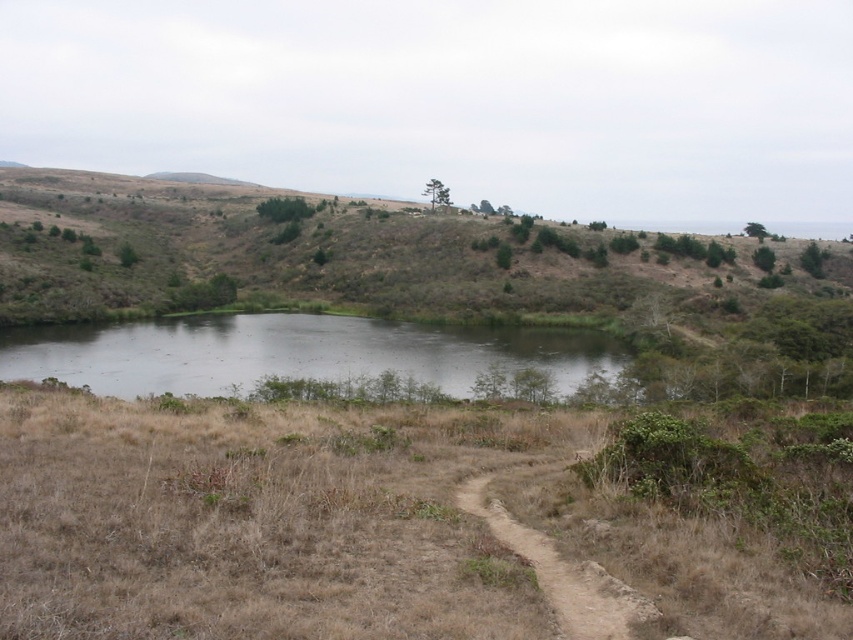
From the picture: Is brown grassy hillside at center below gray reflective water at center?

No, brown grassy hillside at center is not below gray reflective water at center.

Does brown grassy hillside at center have a lesser width compared to gray reflective water at center?

No, brown grassy hillside at center is not thinner than gray reflective water at center.

Which is in front, point (473, 280) or point (577, 349)?

Point (577, 349) is more forward.

At what (x,y) coordinates should I click in order to perform the action: click on brown grassy hillside at center. Please return your answer as a coordinate pair (x, y). Looking at the image, I should click on (358, 257).

Does point (148, 336) come behind point (561, 561)?

That is True.

Which is behind, point (282, 353) or point (598, 598)?

The point (282, 353) is more distant.

Where is `gray reflective water at center`? gray reflective water at center is located at coordinates (294, 353).

Find the location of a particular element. This screenshot has height=640, width=853. gray reflective water at center is located at coordinates (294, 353).

How far apart are brown grassy hillside at center and brown dirt path at center?

brown grassy hillside at center is 912.87 feet from brown dirt path at center.

Does brown grassy hillside at center have a smaller size compared to brown dirt path at center?

No, brown grassy hillside at center is not smaller than brown dirt path at center.

The width and height of the screenshot is (853, 640). Find the location of `brown grassy hillside at center`. brown grassy hillside at center is located at coordinates (358, 257).